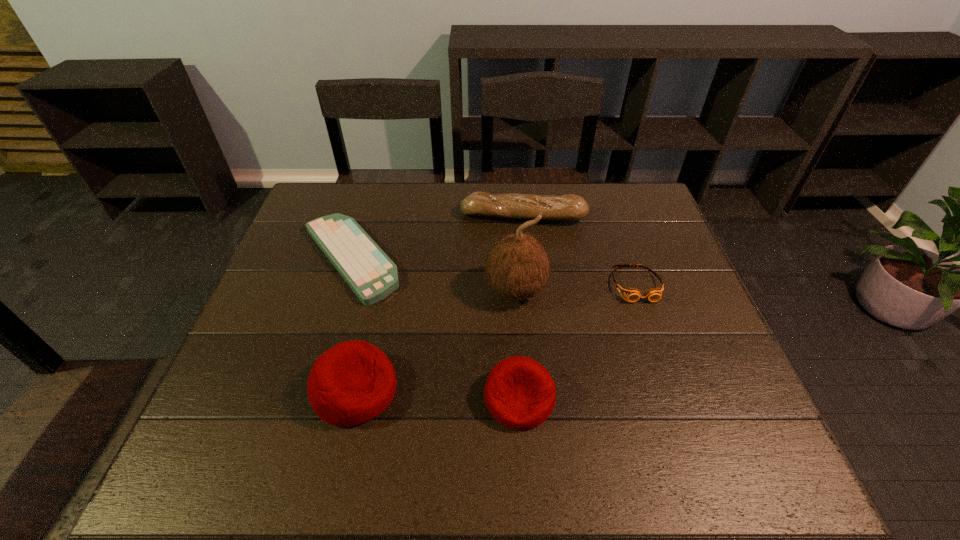
Where is `free location located 0.210m on the front of the baguet`? The image size is (960, 540). free location located 0.210m on the front of the baguet is located at coordinates (530, 277).

I want to click on vacant area situated 0.220m on the right of the shortest object, so click(x=482, y=258).

Locate an element on the screen. Image resolution: width=960 pixels, height=540 pixels. vacant space located with the lenses facing forward on the second shortest object is located at coordinates (671, 387).

This screenshot has width=960, height=540. I want to click on baguet that is at the far edge, so click(x=511, y=205).

This screenshot has height=540, width=960. What are the coordinates of `computer keyboard that is at the far edge` in the screenshot? It's located at (371, 274).

Where is `object at the left edge`? The width and height of the screenshot is (960, 540). object at the left edge is located at coordinates pyautogui.click(x=371, y=274).

Locate an element on the screen. Image resolution: width=960 pixels, height=540 pixels. object that is at the right edge is located at coordinates (632, 294).

The width and height of the screenshot is (960, 540). Find the location of `object that is at the far left corner`. object that is at the far left corner is located at coordinates (371, 274).

The height and width of the screenshot is (540, 960). What are the coordinates of `blank space at the far edge` in the screenshot? It's located at (420, 212).

The width and height of the screenshot is (960, 540). What are the coordinates of `free space at the near edge of the desktop` in the screenshot? It's located at (469, 389).